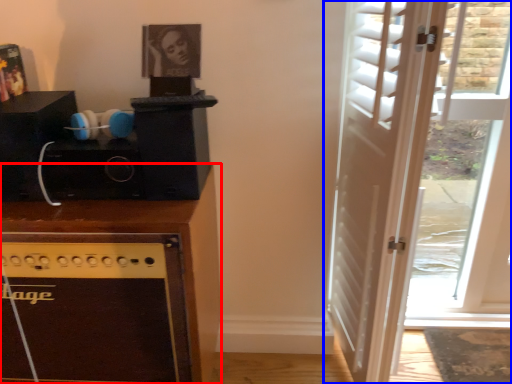
Question: Which object is further to the camera taking this photo, cabinetry (highlighted by a red box) or door (highlighted by a blue box)?

Choices:
 (A) cabinetry
 (B) door

Answer: (A)